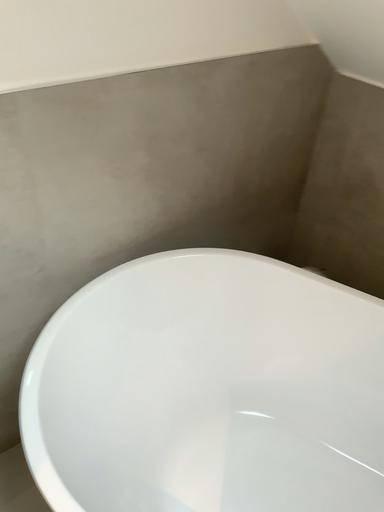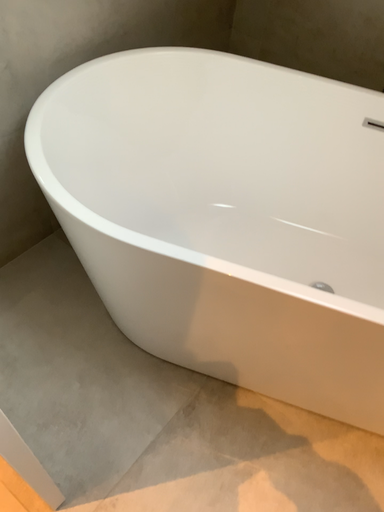
Question: How did the camera likely rotate when shooting the video?

Choices:
 (A) rotated left
 (B) rotated right

Answer: (B)